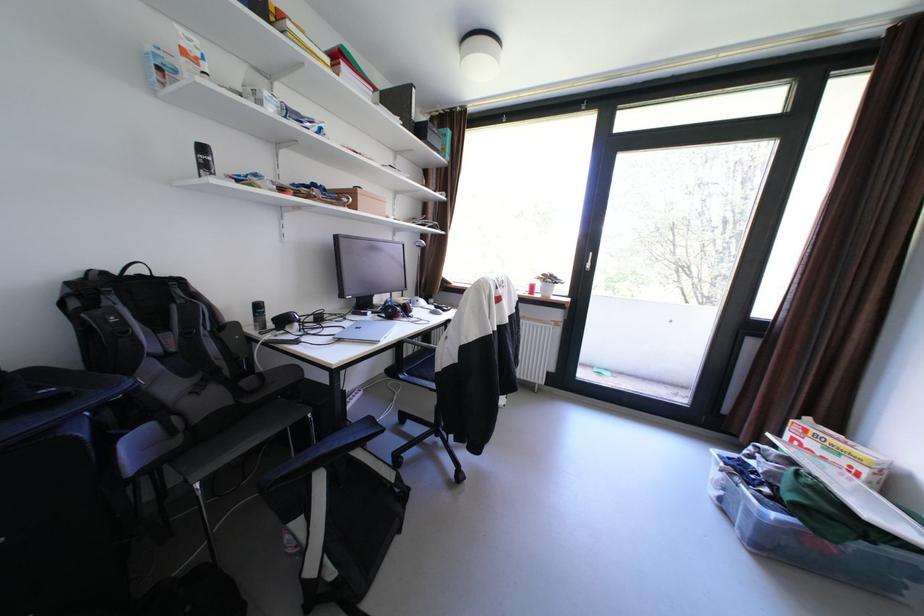
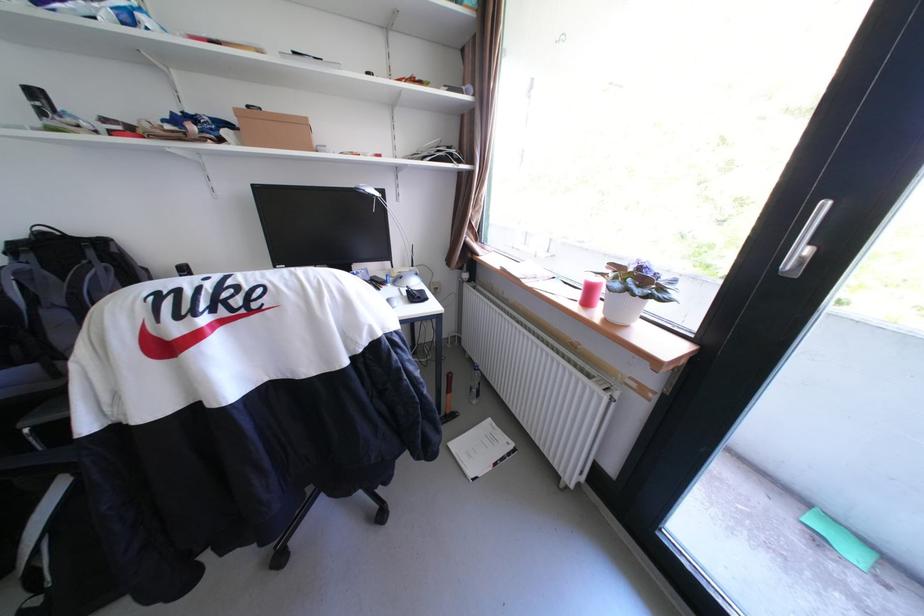
The point at (542,288) is marked in the first image. Where is the corresponding point in the second image?

(601, 291)